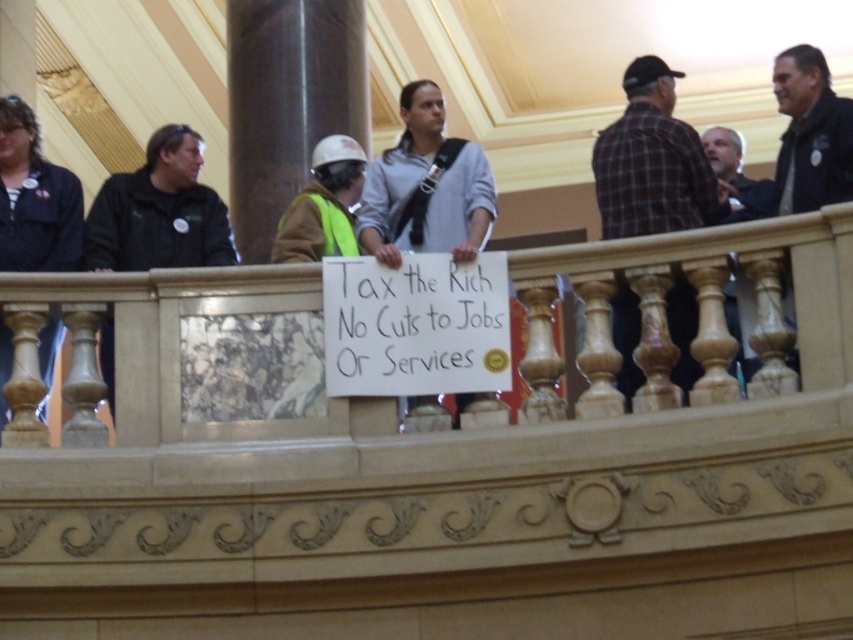
Between black leather jacket at left and dark blue jacket at left, which one has less height?

black leather jacket at left is shorter.

Describe the element at coordinates (160, 211) in the screenshot. I see `black leather jacket at left` at that location.

Is point (192, 228) farther from camera compared to point (70, 260)?

Yes, it is behind point (70, 260).

You are a GUI agent. You are given a task and a screenshot of the screen. Output one action in this format:
    pyautogui.click(x=<x>, y=<y>)
    Task: Click on the black leather jacket at left
    
    Given the screenshot: What is the action you would take?
    pyautogui.click(x=160, y=211)

From the picture: Is plaid flannel shirt at upper right positioned before dark blue jacket at left?

Yes, it is in front of dark blue jacket at left.

Between point (656, 134) and point (41, 342), which one is positioned behind?

The point (656, 134) is behind.

The image size is (853, 640). What are the coordinates of `plaid flannel shirt at upper right` in the screenshot? It's located at (651, 161).

Who is taller, dark blue jacket at left or hard hat at center?

Standing taller between the two is dark blue jacket at left.

Is dark blue jacket at left shorter than hard hat at center?

Incorrect, dark blue jacket at left's height does not fall short of hard hat at center's.

Where is `dark blue jacket at left`? dark blue jacket at left is located at coordinates (33, 198).